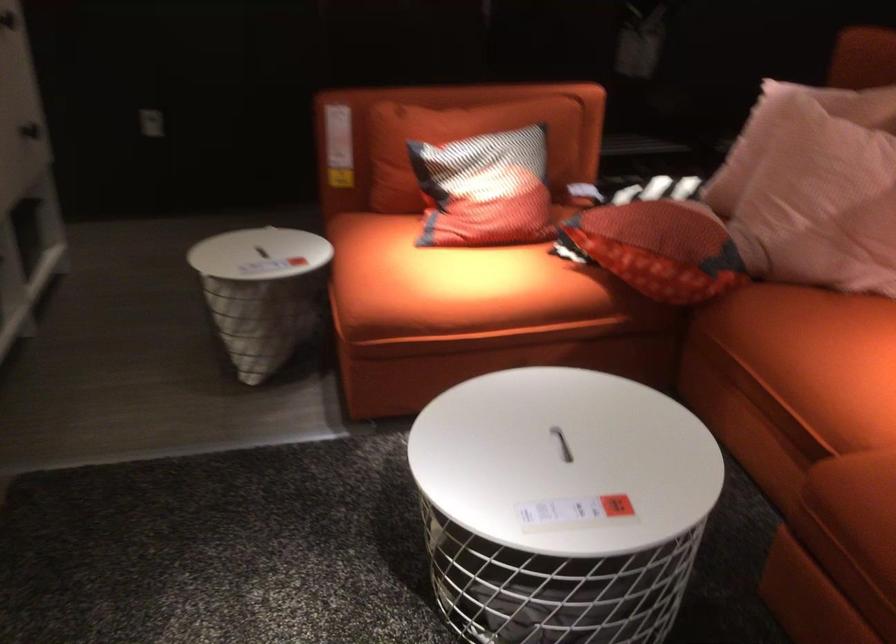
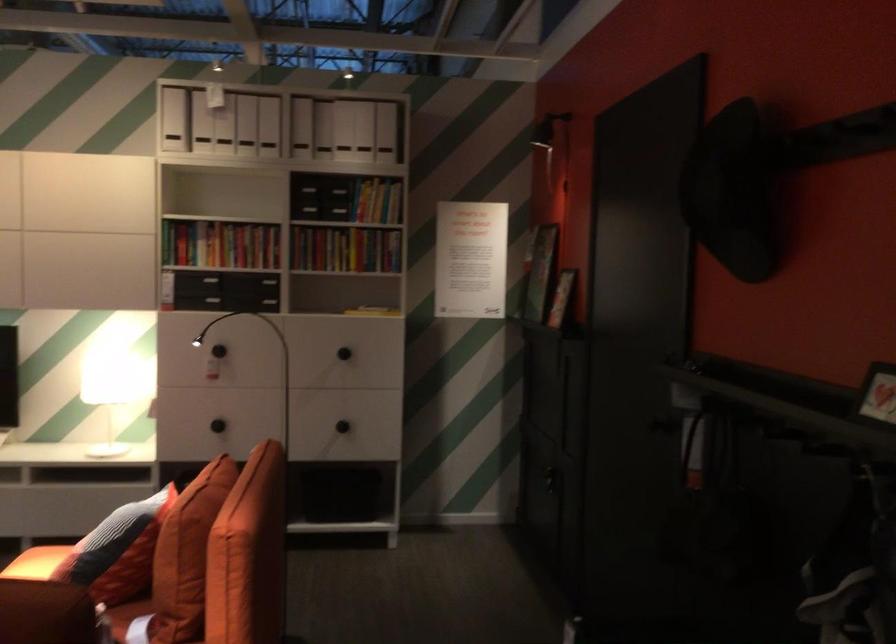
In the second image, find the point that corresponds to pixel 546 152 in the first image.

(117, 551)